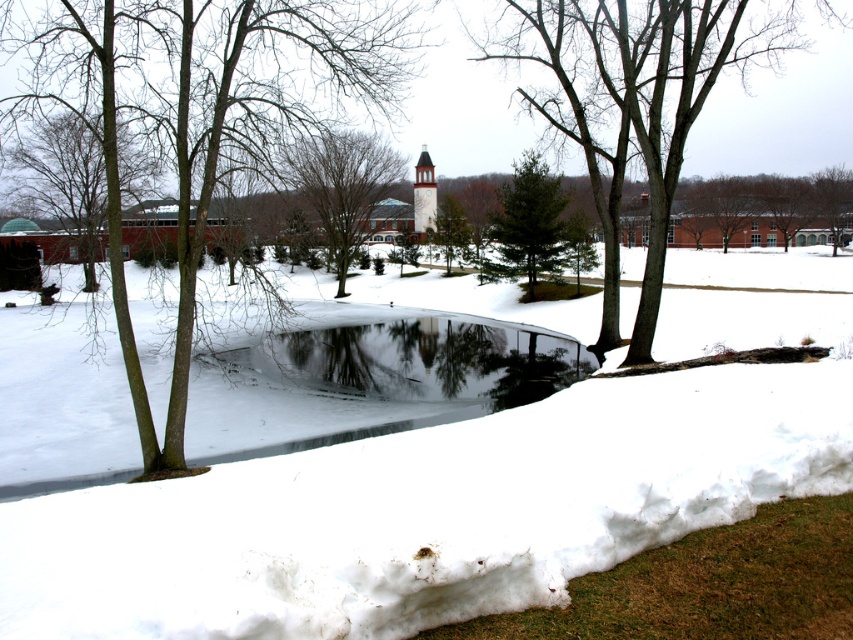
You are standing in the winter scene and want to take a photo of the brown bark tree at left and the green leafy tree at center. Which tree will appear closer to the camera in your photo?

The brown bark tree at left will appear closer to the camera in your photo because it is positioned in front of the green leafy tree at center.

You are an artist planning to paint the winter scene. You want to ensure the brown bark tree at left and the green leafy tree at center are proportionally accurate. Which tree should you make larger in your painting?

The green leafy tree at center should be painted larger than the brown bark tree at left since it is described as larger in the scene.